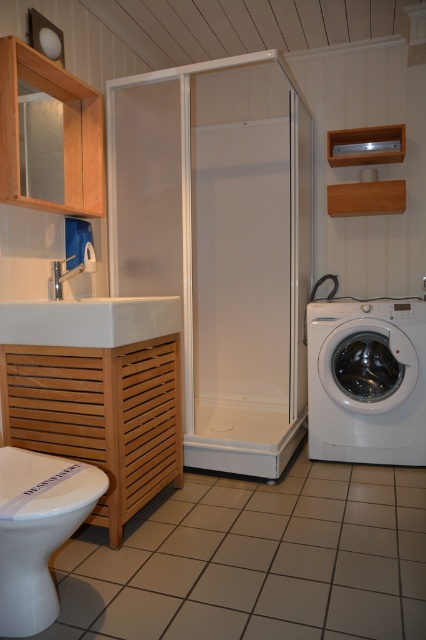
You are standing in the bathroom and want to reach the white glossy toilet bowl at lower left. However, there is a white glossy washing machine at lower right blocking your path. Can you walk around the washing machine to access the toilet bowl?

The white glossy toilet bowl at lower left is behind the white glossy washing machine at lower right, so you can walk around the washing machine to access it.

You are a cleaning robot with a width of 1 meter. You are positioned at the camera location and want to clean the white glossy toilet bowl at lower left. Can you move directly to it without any obstacles?

The distance between the camera and the white glossy toilet bowl at lower left is 1.32 meters. Since the robot is 1 meter wide, it can move directly to the toilet bowl as the path is wide enough.

You are a plumber inspecting a bathroom layout. You need to access the pipes under the white glossy sink at left. Can you reach them by standing behind the white glossy toilet bowl at lower left?

The white glossy toilet bowl at lower left is positioned under the white glossy sink at left, so yes, you can reach the pipes under the white glossy sink at left by standing behind the white glossy toilet bowl at lower left.